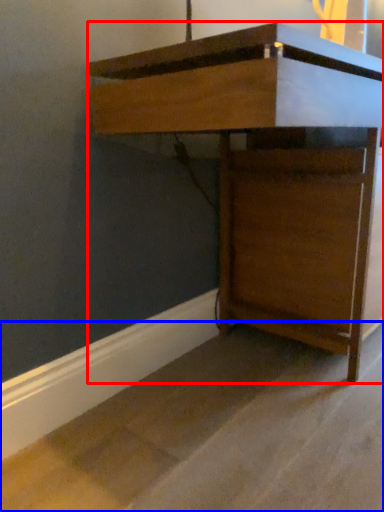
Question: Which object is further to the camera taking this photo, furniture (highlighted by a red box) or concrete (highlighted by a blue box)?

Choices:
 (A) furniture
 (B) concrete

Answer: (A)